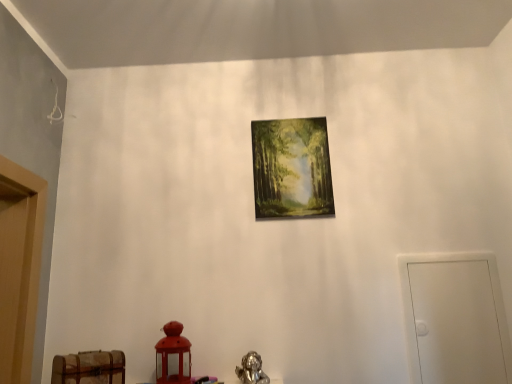
This screenshot has width=512, height=384. Describe the element at coordinates (456, 323) in the screenshot. I see `white matte door at right` at that location.

Where is `wooden chest at lower left`? The height and width of the screenshot is (384, 512). wooden chest at lower left is located at coordinates (89, 368).

What are the coordinates of `matte wooden picture frame at center` in the screenshot? It's located at (292, 169).

Considering the relative positions of wooden chest at lower left and matte wooden picture frame at center in the image provided, is wooden chest at lower left to the left of matte wooden picture frame at center from the viewer's perspective?

Yes.

From the image's perspective, is wooden chest at lower left on matte wooden picture frame at center?

Actually, wooden chest at lower left appears below matte wooden picture frame at center in the image.

Is wooden chest at lower left surrounding matte wooden picture frame at center?

Definitely not — matte wooden picture frame at center is not inside wooden chest at lower left.

Which is nearer, (441, 334) or (296, 147)?

Point (441, 334).

From the image's perspective, is white matte door at right on matte wooden picture frame at center?

Actually, white matte door at right appears below matte wooden picture frame at center in the image.

In the scene shown: Does white matte door at right lie behind matte wooden picture frame at center?

No, white matte door at right is closer to the camera.

Are white matte door at right and matte wooden picture frame at center beside each other?

white matte door at right and matte wooden picture frame at center are not in contact.

Does white matte door at right have a lesser height compared to wooden chest at lower left?

Incorrect, the height of white matte door at right does not fall short of that of wooden chest at lower left.

Based on their positions, is white matte door at right located to the left or right of wooden chest at lower left?

In the image, white matte door at right appears on the right side of wooden chest at lower left.

You are a GUI agent. You are given a task and a screenshot of the screen. Output one action in this format:
    pyautogui.click(x=<x>, y=<y>)
    Task: Click on the door on the right of wooden chest at lower left
    
    Given the screenshot: What is the action you would take?
    pyautogui.click(x=456, y=323)

In the scene shown: Is white matte door at right looking in the opposite direction of wooden chest at lower left?

No, white matte door at right is not facing the opposite direction of wooden chest at lower left.

Could wooden chest at lower left be considered to be inside matte wooden picture frame at center?

No, wooden chest at lower left is located outside of matte wooden picture frame at center.

From the picture: From the image's perspective, which object appears higher, matte wooden picture frame at center or wooden chest at lower left?

matte wooden picture frame at center.

Considering the positions of objects matte wooden picture frame at center and wooden chest at lower left in the image provided, who is in front, matte wooden picture frame at center or wooden chest at lower left?

Positioned in front is wooden chest at lower left.

Would you say wooden chest at lower left is a long distance from white matte door at right?

That's right, there is a large distance between wooden chest at lower left and white matte door at right.

Between wooden chest at lower left and white matte door at right, which one appears on the right side from the viewer's perspective?

From the viewer's perspective, white matte door at right appears more on the right side.

Considering the positions of objects wooden chest at lower left and white matte door at right in the image provided, who is behind, wooden chest at lower left or white matte door at right?

white matte door at right is behind.

From the image's perspective, is matte wooden picture frame at center on white matte door at right?

Correct, matte wooden picture frame at center appears higher than white matte door at right in the image.

From a real-world perspective, is matte wooden picture frame at center positioned over white matte door at right based on gravity?

Correct, in the physical world, matte wooden picture frame at center is higher than white matte door at right.

Is matte wooden picture frame at center spatially inside white matte door at right, or outside of it?

matte wooden picture frame at center cannot be found inside white matte door at right.

Is point (261, 150) positioned behind point (426, 318)?

Yes, point (261, 150) is farther from viewer.

The width and height of the screenshot is (512, 384). Find the location of `furniture lying on the left of matte wooden picture frame at center`. furniture lying on the left of matte wooden picture frame at center is located at coordinates (89, 368).

In order to click on picture frame behind the white matte door at right in this screenshot , I will do `click(292, 169)`.

Looking at the image, which one is located closer to wooden chest at lower left, matte wooden picture frame at center or white matte door at right?

matte wooden picture frame at center lies closer to wooden chest at lower left than the other object.

Which object lies nearer to the anchor point white matte door at right, wooden chest at lower left or matte wooden picture frame at center?

The object closer to white matte door at right is matte wooden picture frame at center.

Considering their positions, is matte wooden picture frame at center positioned further to white matte door at right than wooden chest at lower left?

wooden chest at lower left.

Estimate the real-world distances between objects in this image. Which object is further from matte wooden picture frame at center, white matte door at right or wooden chest at lower left?

wooden chest at lower left is positioned further to the anchor matte wooden picture frame at center.

From the image, which object appears to be farther from wooden chest at lower left, white matte door at right or matte wooden picture frame at center?

The object further to wooden chest at lower left is white matte door at right.

Based on their spatial positions, is wooden chest at lower left or white matte door at right further from matte wooden picture frame at center?

wooden chest at lower left lies further to matte wooden picture frame at center than the other object.

Identify the location of picture frame situated between wooden chest at lower left and white matte door at right from left to right. This screenshot has height=384, width=512. (292, 169).